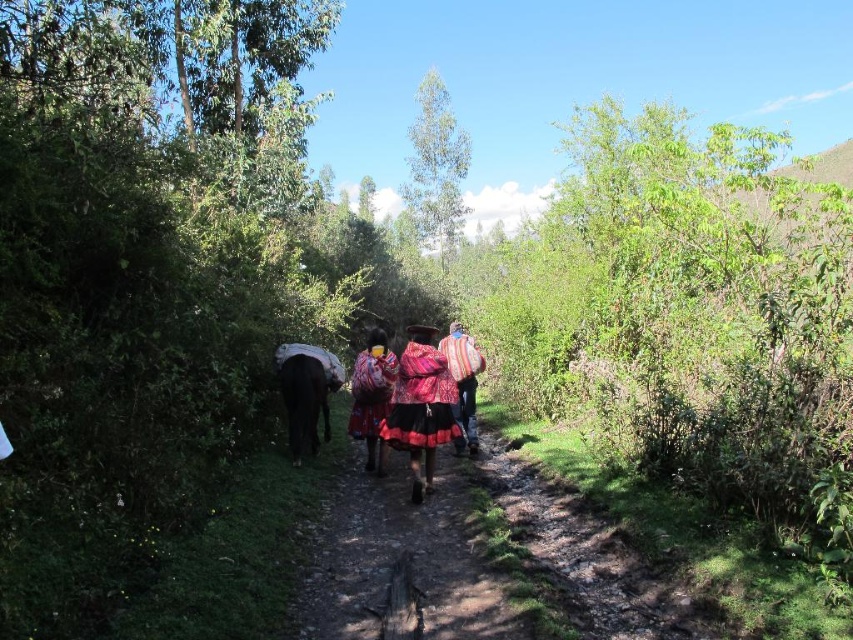
You are a photographer trying to capture the multicolored woven shawl at center and the textured woolen shawl at center in the same frame. Based on their sizes, which shawl should you focus on to ensure both fit in the photo?

The multicolored woven shawl at center might be wider than the textured woolen shawl at center, so focusing on the multicolored woven shawl at center would ensure both fit in the photo.

You are a photographer trying to capture a group of people in a rural setting. You notice the multicolored woven skirt at center and the textured woolen shawl at center. If your camera has a minimum focus distance of 1.5 meters, will you be able to focus on both items simultaneously?

The distance between the multicolored woven skirt at center and the textured woolen shawl at center is 1.41 meters. Since the minimum focus distance is 1.5 meters, the camera cannot focus on both items at the same time because they are closer than the required distance.